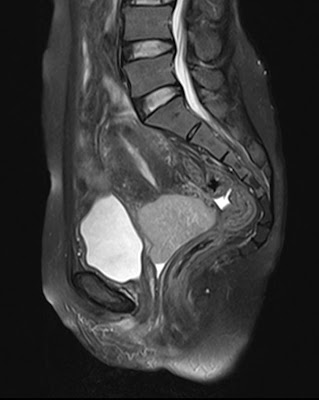
Find the location of a particular element. The height and width of the screenshot is (400, 319). white organ is located at coordinates (121, 238).